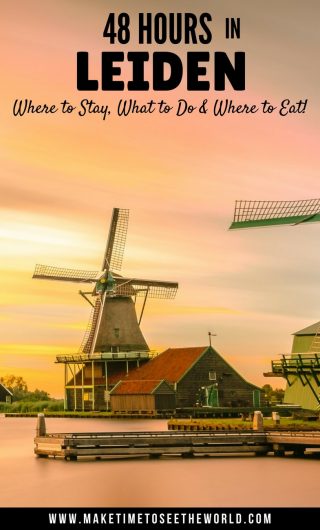
Find the location of a particular element. Image resolution: width=320 pixels, height=530 pixels. windows is located at coordinates (211, 374), (91, 395), (86, 395), (108, 395), (9, 398).